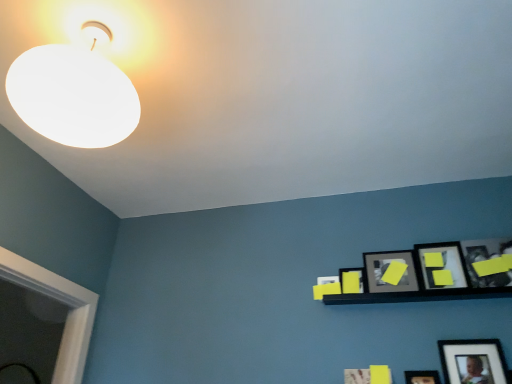
Question: Would you say matte black picture frame at upper right, which ranks as the fourth picture frame in right-to-left order, is to the left or to the right of white matte lampshade at upper left in the picture?

Choices:
 (A) right
 (B) left

Answer: (A)

Question: Which is correct: matte black picture frame at upper right, which ranks as the fourth picture frame in right-to-left order, is inside white matte lampshade at upper left, or outside of it?

Choices:
 (A) inside
 (B) outside

Answer: (B)

Question: Based on their relative distances, which object is nearer to the yellow matte picture frame at upper right, the first picture frame in the right-to-left sequence?

Choices:
 (A) matte black picture frame at upper right, which ranks as the fourth picture frame in right-to-left order
 (B) white matte lampshade at upper left
 (C) matte black picture frame at lower right, the second picture frame in the right-to-left sequence
 (D) yellow matte picture frame at upper right, placed as the 3th picture frame when sorted from right to left
 (E) yellow matte picture frame at upper right, the first picture frame viewed from the left

Answer: (D)

Question: Based on their relative distances, which object is farther from the matte black picture frame at upper right, which ranks as the fourth picture frame in right-to-left order?

Choices:
 (A) yellow matte picture frame at upper right, placed as the 3th picture frame when sorted from right to left
 (B) white matte lampshade at upper left
 (C) yellow matte picture frame at upper right, the first picture frame viewed from the left
 (D) yellow matte picture frame at upper right, the first picture frame in the right-to-left sequence
 (E) matte black picture frame at lower right, positioned as the fourth picture frame in left-to-right order

Answer: (B)